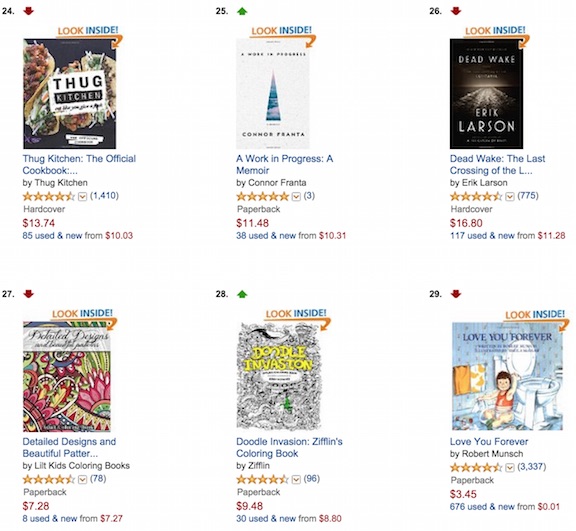
You are a GUI agent. You are given a task and a screenshot of the screen. Output one action in this format:
    pyautogui.click(x=<x>, y=<y>)
    Task: Click on the books
    
    Given the screenshot: What is the action you would take?
    pyautogui.click(x=55, y=376), pyautogui.click(x=501, y=401), pyautogui.click(x=472, y=114), pyautogui.click(x=302, y=91), pyautogui.click(x=85, y=81)